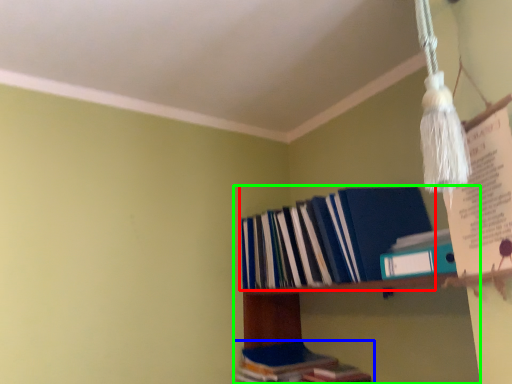
Question: Based on their relative distances, which object is nearer to book (highlighted by a red box)? Choose from book (highlighted by a blue box) and shelf (highlighted by a green box).

Choices:
 (A) book
 (B) shelf

Answer: (B)